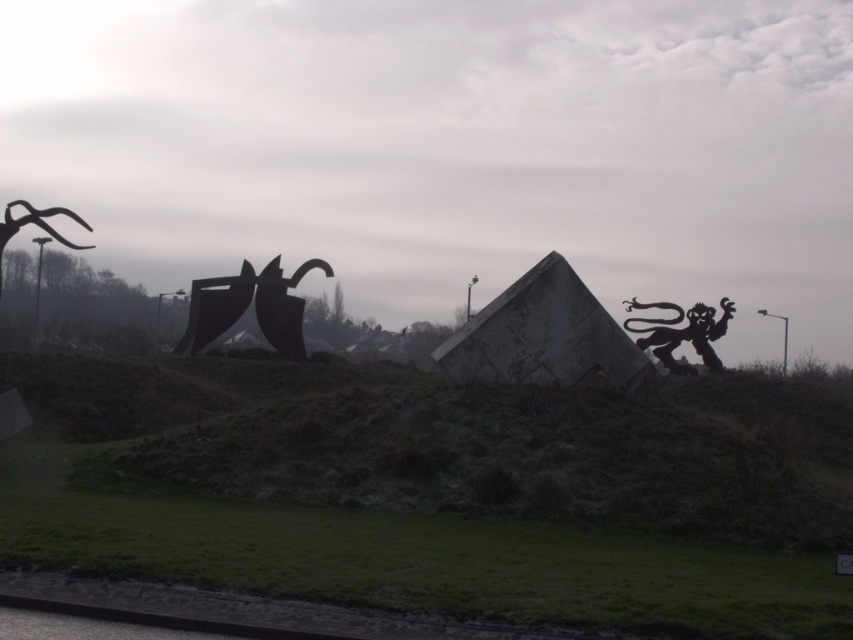
Question: Can you confirm if black matte sculpture at center is positioned above polished metal antlers at left?

Choices:
 (A) yes
 (B) no

Answer: (B)

Question: Which point is closer to the camera taking this photo?

Choices:
 (A) (642, 580)
 (B) (4, 209)
 (C) (260, 291)

Answer: (A)

Question: Does green grass at lower center lie behind dark matte lion at upper right?

Choices:
 (A) yes
 (B) no

Answer: (B)

Question: Can you confirm if dark matte lion at upper right is positioned to the right of polished metal antlers at left?

Choices:
 (A) no
 (B) yes

Answer: (B)

Question: Which point is closer to the camera?

Choices:
 (A) dark matte lion at upper right
 (B) polished metal antlers at left
 (C) green grass at lower center
 (D) black matte sculpture at center

Answer: (C)

Question: Which point is closer to the camera?

Choices:
 (A) (16, 200)
 (B) (647, 328)

Answer: (B)